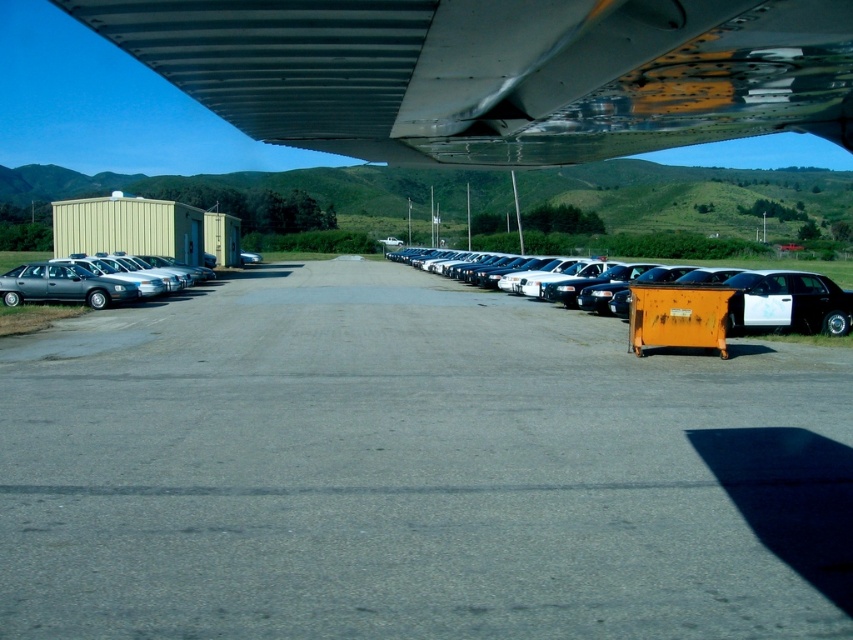
Question: Does gray asphalt runway at lower left lie behind metallic silver sedan at left?

Choices:
 (A) yes
 (B) no

Answer: (B)

Question: Which of these objects is positioned farthest from the gray asphalt runway at lower left?

Choices:
 (A) metallic silver sedan at center right
 (B) metallic gray wing at upper center

Answer: (A)

Question: Estimate the real-world distances between objects in this image. Which object is closer to the gray asphalt runway at lower left?

Choices:
 (A) metallic silver sedan at left
 (B) metallic silver sedan at center right
 (C) metallic gray wing at upper center

Answer: (C)

Question: Is gray asphalt runway at lower left thinner than metallic gray wing at upper center?

Choices:
 (A) no
 (B) yes

Answer: (A)

Question: Is gray asphalt runway at lower left to the right of metallic gray wing at upper center from the viewer's perspective?

Choices:
 (A) yes
 (B) no

Answer: (B)

Question: Which of the following is the closest to the observer?

Choices:
 (A) (44, 289)
 (B) (328, 410)
 (C) (807, 308)

Answer: (B)